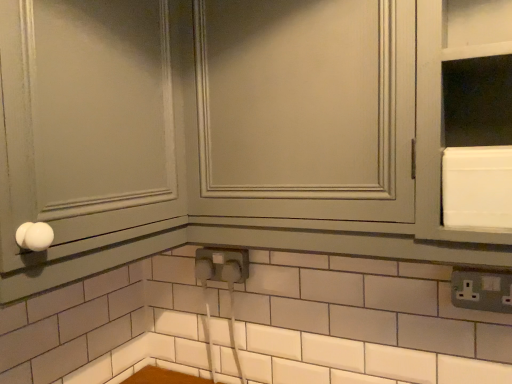
Question: From the image's perspective, does white glossy cabinet at center appear lower than gray plastic electrical outlet at lower right?

Choices:
 (A) yes
 (B) no

Answer: (B)

Question: Is white glossy cabinet at center beside gray plastic electrical outlet at lower right?

Choices:
 (A) no
 (B) yes

Answer: (A)

Question: Considering the relative sizes of white glossy cabinet at center and gray plastic electrical outlet at lower right in the image provided, is white glossy cabinet at center thinner than gray plastic electrical outlet at lower right?

Choices:
 (A) yes
 (B) no

Answer: (B)

Question: Can we say white glossy cabinet at center lies outside gray plastic electrical outlet at lower right?

Choices:
 (A) no
 (B) yes

Answer: (B)

Question: Is white glossy cabinet at center further to the viewer compared to gray plastic electrical outlet at lower right?

Choices:
 (A) yes
 (B) no

Answer: (B)

Question: Does white glossy cabinet at center have a smaller size compared to gray plastic electrical outlet at lower right?

Choices:
 (A) no
 (B) yes

Answer: (A)

Question: From a real-world perspective, is gray plastic electrical outlet at lower right physically below white glossy cabinet at center?

Choices:
 (A) yes
 (B) no

Answer: (A)

Question: From the image's perspective, is gray plastic electrical outlet at lower right on white glossy cabinet at center?

Choices:
 (A) no
 (B) yes

Answer: (A)

Question: Does gray plastic electrical outlet at lower right have a greater width compared to white glossy cabinet at center?

Choices:
 (A) yes
 (B) no

Answer: (B)

Question: Is there a large distance between gray plastic electrical outlet at lower right and white glossy cabinet at center?

Choices:
 (A) no
 (B) yes

Answer: (A)

Question: From a real-world perspective, is gray plastic electrical outlet at lower right physically above white glossy cabinet at center?

Choices:
 (A) yes
 (B) no

Answer: (B)

Question: Is gray plastic electrical outlet at lower right not within white glossy cabinet at center?

Choices:
 (A) yes
 (B) no

Answer: (A)

Question: From a real-world perspective, is gray plastic electrical outlet at lower right below white glossy knob at left?

Choices:
 (A) yes
 (B) no

Answer: (A)